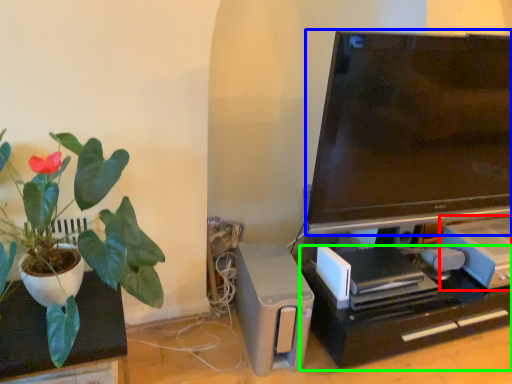
Question: Which object is the closest to the appliance (highlighted by a red box)? Choose among these: television (highlighted by a blue box) or computer desk (highlighted by a green box).

Choices:
 (A) television
 (B) computer desk

Answer: (B)